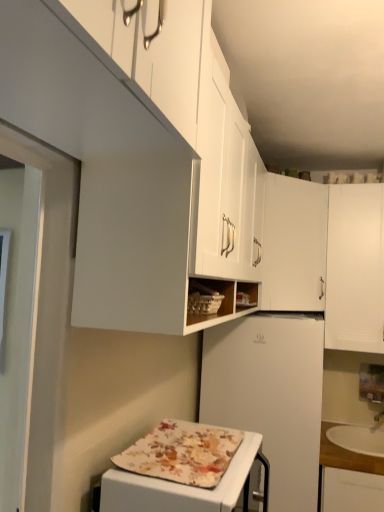
Question: From the image's perspective, is white matte refrigerator at center located above white matte cabinet at upper right, arranged as the third cabinetry when viewed from the left?

Choices:
 (A) no
 (B) yes

Answer: (A)

Question: Is white matte refrigerator at center looking in the opposite direction of white matte cabinet at upper right, arranged as the third cabinetry when viewed from the left?

Choices:
 (A) no
 (B) yes

Answer: (A)

Question: From a real-world perspective, is white matte refrigerator at center located beneath white matte cabinet at upper right, which is the 1th cabinetry from right to left?

Choices:
 (A) yes
 (B) no

Answer: (A)

Question: From the image's perspective, would you say white matte refrigerator at center is shown under white matte cabinet at upper right, which is the 1th cabinetry from right to left?

Choices:
 (A) no
 (B) yes

Answer: (B)

Question: Considering the relative sizes of white matte refrigerator at center and white matte cabinet at upper right, which is the 1th cabinetry from right to left, in the image provided, is white matte refrigerator at center wider than white matte cabinet at upper right, which is the 1th cabinetry from right to left,?

Choices:
 (A) no
 (B) yes

Answer: (B)

Question: Considering the positions of floral fabric-covered appliance at lower center and white matte refrigerator at center in the image, is floral fabric-covered appliance at lower center wider or thinner than white matte refrigerator at center?

Choices:
 (A) thin
 (B) wide

Answer: (A)

Question: Considering the positions of floral fabric-covered appliance at lower center and white matte refrigerator at center in the image, is floral fabric-covered appliance at lower center taller or shorter than white matte refrigerator at center?

Choices:
 (A) tall
 (B) short

Answer: (B)

Question: Do you think floral fabric-covered appliance at lower center is within white matte refrigerator at center, or outside of it?

Choices:
 (A) outside
 (B) inside

Answer: (A)

Question: Considering their positions, is floral fabric-covered appliance at lower center located in front of or behind white matte refrigerator at center?

Choices:
 (A) front
 (B) behind

Answer: (A)

Question: Considering the positions of white matte refrigerator at center and white matte cabinet at upper right, which is the 1th cabinetry from right to left, in the image, is white matte refrigerator at center wider or thinner than white matte cabinet at upper right, which is the 1th cabinetry from right to left,?

Choices:
 (A) thin
 (B) wide

Answer: (B)

Question: Is white matte refrigerator at center situated inside white matte cabinet at upper right, which is the 1th cabinetry from right to left, or outside?

Choices:
 (A) outside
 (B) inside

Answer: (A)

Question: From a real-world perspective, is white matte refrigerator at center positioned above or below white matte cabinet at upper right, arranged as the third cabinetry when viewed from the left?

Choices:
 (A) below
 (B) above

Answer: (A)

Question: Is white matte refrigerator at center to the left or to the right of white matte cabinet at upper right, which is the 1th cabinetry from right to left, in the image?

Choices:
 (A) right
 (B) left

Answer: (B)

Question: Considering the positions of point (266, 273) and point (69, 144), is point (266, 273) closer or farther from the camera than point (69, 144)?

Choices:
 (A) closer
 (B) farther

Answer: (B)

Question: From the image's perspective, relative to white matte cabinet at upper center, placed as the 1th cabinetry when sorted from left to right, is white matte cabinet at upper center, the 2th cabinetry from the right, above or below?

Choices:
 (A) below
 (B) above

Answer: (A)